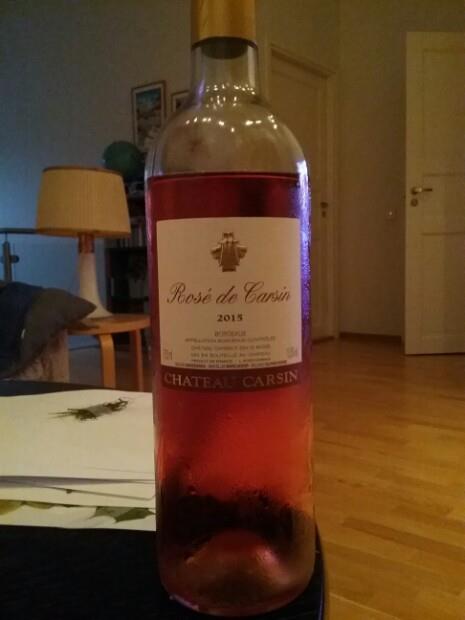
In order to click on black table in this screenshot , I will do `click(93, 582)`, `click(14, 387)`.